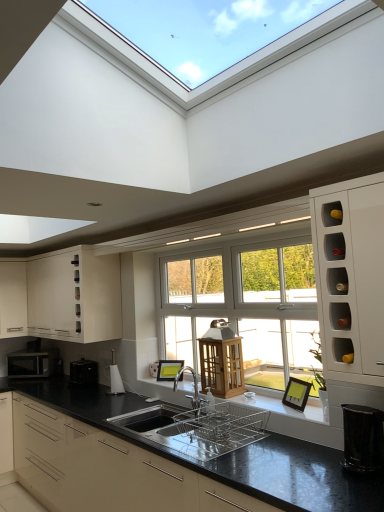
Question: Considering the relative sizes of silver metallic microwave at left and white matte cabinet at left, which is counted as the second cabinetry, starting from the bottom, in the image provided, is silver metallic microwave at left thinner than white matte cabinet at left, which is counted as the second cabinetry, starting from the bottom,?

Choices:
 (A) no
 (B) yes

Answer: (B)

Question: Can you confirm if silver metallic microwave at left is smaller than white matte cabinet at left, which is the third cabinetry in top-to-bottom order?

Choices:
 (A) no
 (B) yes

Answer: (B)

Question: Is silver metallic microwave at left taller than white matte cabinet at left, which is the third cabinetry in top-to-bottom order?

Choices:
 (A) yes
 (B) no

Answer: (B)

Question: From a real-world perspective, is silver metallic microwave at left positioned over white matte cabinet at left, which is the third cabinetry in top-to-bottom order, based on gravity?

Choices:
 (A) yes
 (B) no

Answer: (B)

Question: Is silver metallic microwave at left positioned with its back to white matte cabinet at left, which is counted as the second cabinetry, starting from the bottom?

Choices:
 (A) yes
 (B) no

Answer: (B)

Question: Do you think matte white cabinet at upper left, positioned as the second cabinetry in top-to-bottom order, is within silver metallic microwave at left, or outside of it?

Choices:
 (A) inside
 (B) outside

Answer: (B)

Question: From the image's perspective, relative to silver metallic microwave at left, is matte white cabinet at upper left, positioned as the second cabinetry in top-to-bottom order, above or below?

Choices:
 (A) below
 (B) above

Answer: (B)

Question: Is matte white cabinet at upper left, positioned as the 3th cabinetry in bottom-to-top order, wider or thinner than silver metallic microwave at left?

Choices:
 (A) thin
 (B) wide

Answer: (B)

Question: Based on their positions, is matte white cabinet at upper left, positioned as the second cabinetry in top-to-bottom order, located to the left or right of silver metallic microwave at left?

Choices:
 (A) right
 (B) left

Answer: (A)

Question: Visually, is matte white cabinet at upper left, positioned as the 3th cabinetry in bottom-to-top order, positioned to the left or to the right of polished stainless steel dish rack at center, the second appliance positioned from the front?

Choices:
 (A) left
 (B) right

Answer: (A)

Question: From a real-world perspective, is matte white cabinet at upper left, positioned as the 3th cabinetry in bottom-to-top order, above or below polished stainless steel dish rack at center, which is counted as the 3th appliance, starting from the back?

Choices:
 (A) below
 (B) above

Answer: (B)

Question: Considering the positions of point (115, 303) and point (190, 424), is point (115, 303) closer or farther from the camera than point (190, 424)?

Choices:
 (A) farther
 (B) closer

Answer: (A)

Question: From their relative heights in the image, would you say matte white cabinet at upper left, positioned as the 3th cabinetry in bottom-to-top order, is taller or shorter than polished stainless steel dish rack at center, the second appliance positioned from the front?

Choices:
 (A) tall
 (B) short

Answer: (A)

Question: Does point (359, 422) appear closer or farther from the camera than point (195, 395)?

Choices:
 (A) closer
 (B) farther

Answer: (A)

Question: From a real-world perspective, is black glossy trash can at lower right, placed as the first appliance when sorted from right to left, positioned above or below silver metallic tap at center?

Choices:
 (A) above
 (B) below

Answer: (B)